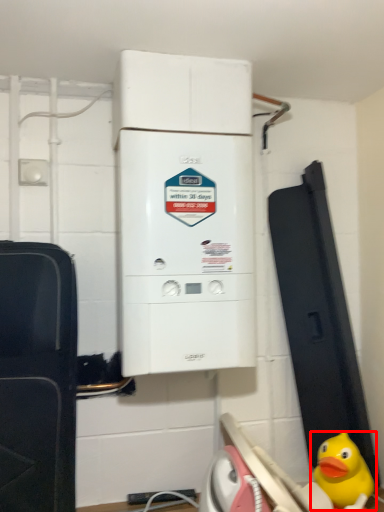
Question: From the image's perspective, where is toy (annotated by the red box) located in relation to home appliance in the image?

Choices:
 (A) below
 (B) above

Answer: (A)